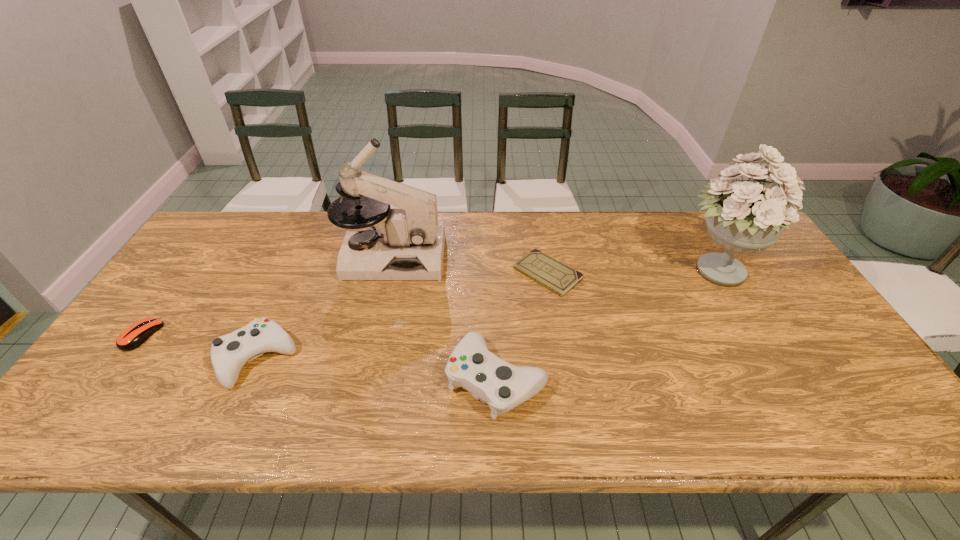
Find the location of a particular element. This screenshot has width=960, height=540. the fourth tallest object is located at coordinates point(229,353).

Image resolution: width=960 pixels, height=540 pixels. I want to click on the left control, so click(x=229, y=353).

Image resolution: width=960 pixels, height=540 pixels. What are the coordinates of `the taller control` in the screenshot? It's located at (503, 386).

You are a GUI agent. You are given a task and a screenshot of the screen. Output one action in this format:
    pyautogui.click(x=<x>, y=<y>)
    Task: Click on the third tallest object
    This screenshot has width=960, height=540.
    Given the screenshot: What is the action you would take?
    pyautogui.click(x=503, y=386)

The image size is (960, 540). I want to click on the fourth object from right to left, so pos(406,244).

Identify the location of bouquet. The height and width of the screenshot is (540, 960). (746, 217).

Locate an element on the screen. The height and width of the screenshot is (540, 960). the shortest object is located at coordinates (545, 270).

Find the location of a particular element. The height and width of the screenshot is (540, 960). the second shortest object is located at coordinates (131, 338).

The height and width of the screenshot is (540, 960). I want to click on the leftmost object, so click(x=131, y=338).

This screenshot has height=540, width=960. What are the coordinates of `free location located on the left of the fifth object from right to left` in the screenshot? It's located at (154, 359).